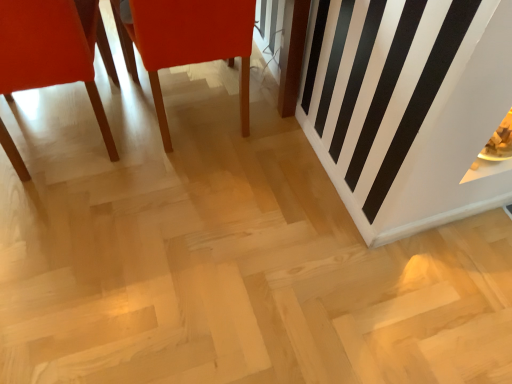
Question: Is matte orange chair at left, which is the second chair in right-to-left order, at the left side of matte wood chair at center, which is counted as the second chair, starting from the left?

Choices:
 (A) no
 (B) yes

Answer: (B)

Question: From a real-world perspective, is matte orange chair at left, which is the second chair in right-to-left order, on matte wood chair at center, which is counted as the second chair, starting from the left?

Choices:
 (A) yes
 (B) no

Answer: (A)

Question: Is matte orange chair at left, which is the second chair in right-to-left order, wider than matte wood chair at center, the 1th chair viewed from the right?

Choices:
 (A) yes
 (B) no

Answer: (B)

Question: Is matte orange chair at left, which is the second chair in right-to-left order, positioned far away from matte wood chair at center, the 1th chair viewed from the right?

Choices:
 (A) no
 (B) yes

Answer: (A)

Question: Considering the relative sizes of matte orange chair at left, which is the second chair in right-to-left order, and matte wood chair at center, which is counted as the second chair, starting from the left, in the image provided, is matte orange chair at left, which is the second chair in right-to-left order, bigger than matte wood chair at center, which is counted as the second chair, starting from the left,?

Choices:
 (A) yes
 (B) no

Answer: (A)

Question: Is matte orange chair at left, the 1th chair viewed from the left, positioned beyond the bounds of matte wood chair at center, the 1th chair viewed from the right?

Choices:
 (A) yes
 (B) no

Answer: (A)

Question: Does matte wood chair at center, which is counted as the second chair, starting from the left, appear on the right side of matte orange chair at left, which is the second chair in right-to-left order?

Choices:
 (A) yes
 (B) no

Answer: (A)

Question: Does matte wood chair at center, which is counted as the second chair, starting from the left, have a smaller size compared to matte orange chair at left, which is the second chair in right-to-left order?

Choices:
 (A) yes
 (B) no

Answer: (A)

Question: From the image's perspective, is matte wood chair at center, the 1th chair viewed from the right, under matte orange chair at left, which is the second chair in right-to-left order?

Choices:
 (A) no
 (B) yes

Answer: (A)

Question: From a real-world perspective, is matte wood chair at center, which is counted as the second chair, starting from the left, physically above matte orange chair at left, the 1th chair viewed from the left?

Choices:
 (A) yes
 (B) no

Answer: (B)

Question: From the image's perspective, is matte wood chair at center, which is counted as the second chair, starting from the left, on top of matte orange chair at left, the 1th chair viewed from the left?

Choices:
 (A) yes
 (B) no

Answer: (A)

Question: Is the position of matte wood chair at center, which is counted as the second chair, starting from the left, less distant than that of matte orange chair at left, the 1th chair viewed from the left?

Choices:
 (A) yes
 (B) no

Answer: (B)

Question: In terms of height, does matte wood chair at center, the 1th chair viewed from the right, look taller or shorter compared to matte orange chair at left, which is the second chair in right-to-left order?

Choices:
 (A) tall
 (B) short

Answer: (B)